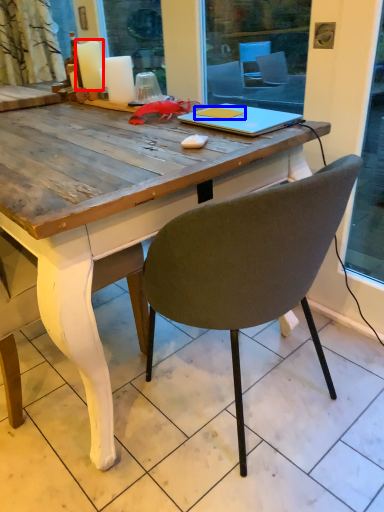
Question: Among these objects, which one is nearest to the camera, candle (highlighted by a red box) or notebook (highlighted by a blue box)?

Choices:
 (A) candle
 (B) notebook

Answer: (B)